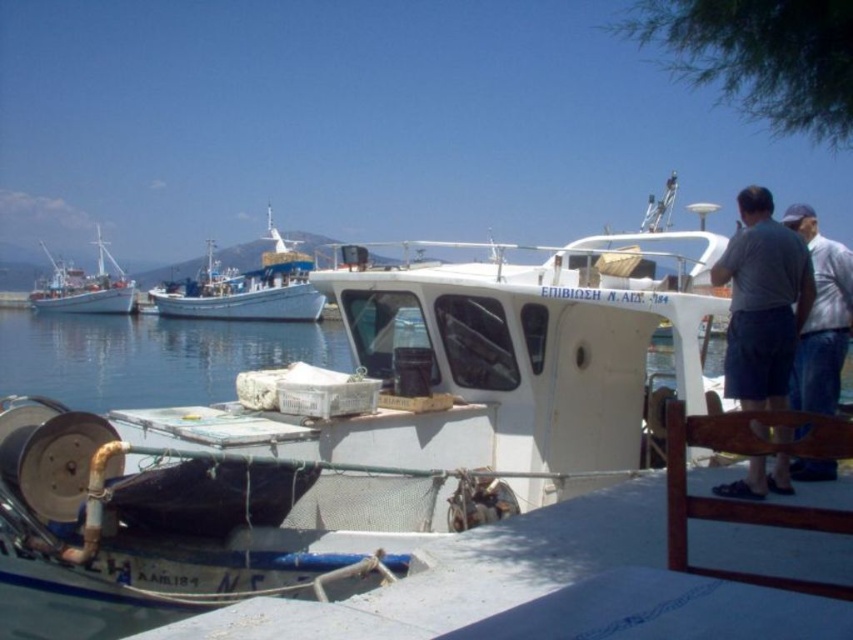
Question: Is dark blue shorts at right to the right of blue painted wooden fishing boat at center from the viewer's perspective?

Choices:
 (A) yes
 (B) no

Answer: (A)

Question: Does gray cotton shirt at right have a greater width compared to white matte fishing boat at left?

Choices:
 (A) yes
 (B) no

Answer: (B)

Question: Which of the following is the closest to the observer?

Choices:
 (A) dark blue shorts at right
 (B) gray cotton shirt at right
 (C) blue painted wooden fishing boat at center
 (D) white matte fishing boat at left

Answer: (B)

Question: Is dark blue shorts at right closer to the viewer compared to blue painted wooden fishing boat at center?

Choices:
 (A) no
 (B) yes

Answer: (B)

Question: Estimate the real-world distances between objects in this image. Which object is closer to the dark blue shorts at right?

Choices:
 (A) blue painted wooden fishing boat at center
 (B) gray cotton shirt at right
 (C) white matte fishing boat at left

Answer: (B)

Question: Among these points, which one is nearest to the camera?

Choices:
 (A) (241, 296)
 (B) (113, 260)
 (C) (757, 378)
 (D) (827, 406)

Answer: (C)